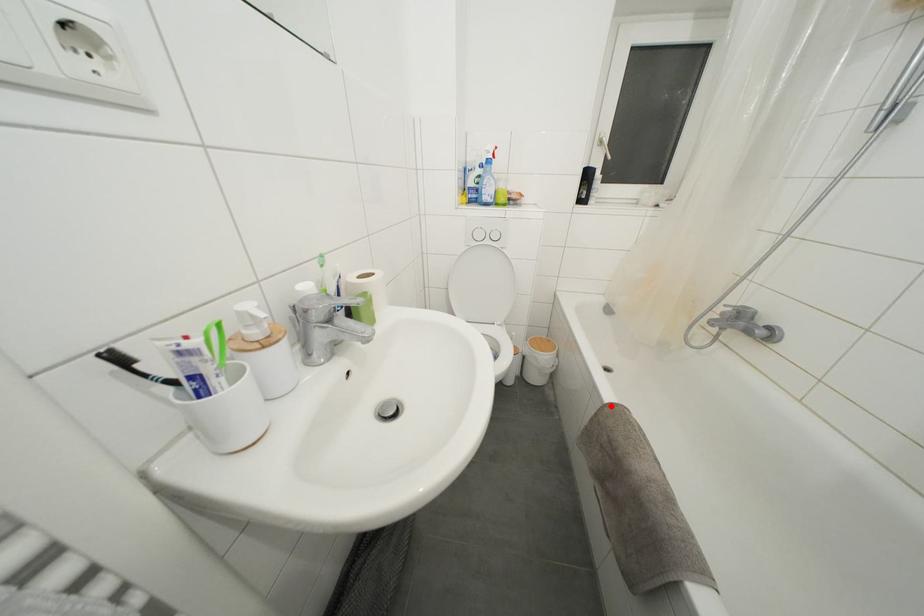
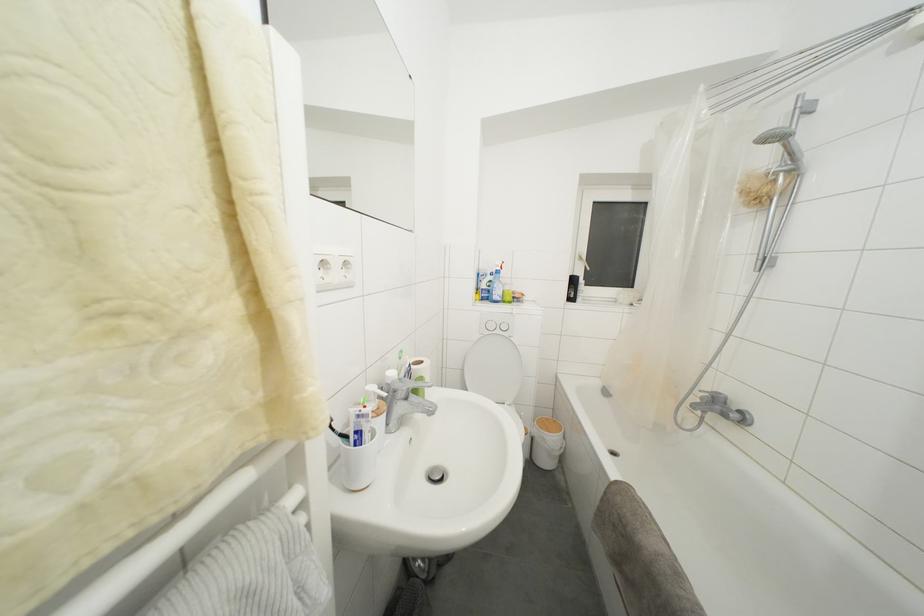
Question: A red point is marked in image1. In image2, is the corresponding 3D point closer to the camera or farther? Reply with the corresponding letter.

Choices:
 (A) The corresponding 3D point is closer.
 (B) The corresponding 3D point is farther.

Answer: (B)